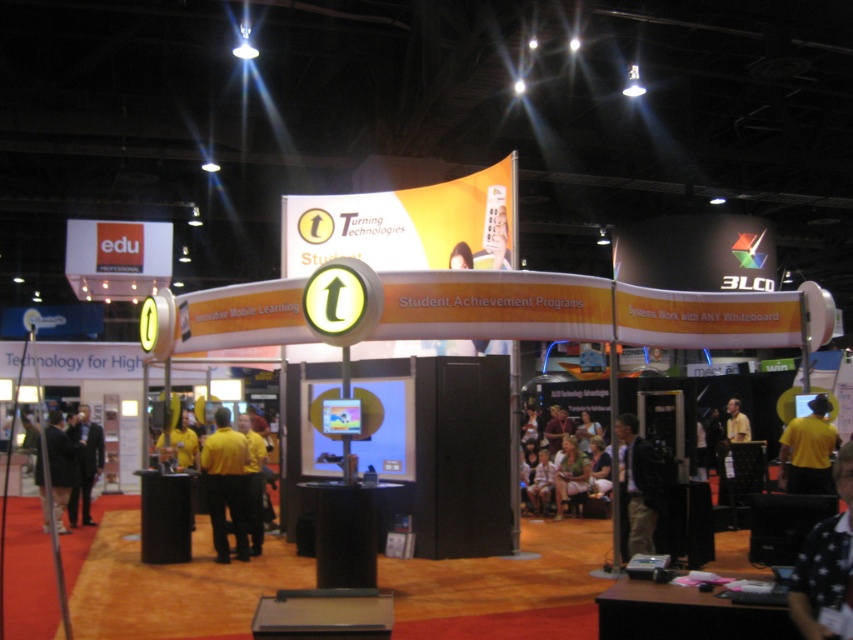
Image resolution: width=853 pixels, height=640 pixels. What do you see at coordinates (577, 465) in the screenshot?
I see `light brown fabric chair at center` at bounding box center [577, 465].

Between point (558, 509) and point (241, 413), which one is positioned behind?

The point (241, 413) is more distant.

Locate an element on the screen. light brown fabric chair at center is located at coordinates (577, 465).

Can you confirm if yellow shirt at center is taller than light green fabric shirt at center?

Yes, yellow shirt at center is taller than light green fabric shirt at center.

Identify the location of yellow shirt at center. The image size is (853, 640). (253, 483).

Between point (62, 509) and point (253, 554), which one is positioned in front?

Point (253, 554) is more forward.

Measure the distance between point (54, 460) and camera.

Point (54, 460) is 44.18 feet away from camera.

Who is more forward, (x=54, y=440) or (x=260, y=493)?

Point (x=260, y=493) is more forward.

In order to click on dark gray suit at lower left in this screenshot , I will do `click(61, 465)`.